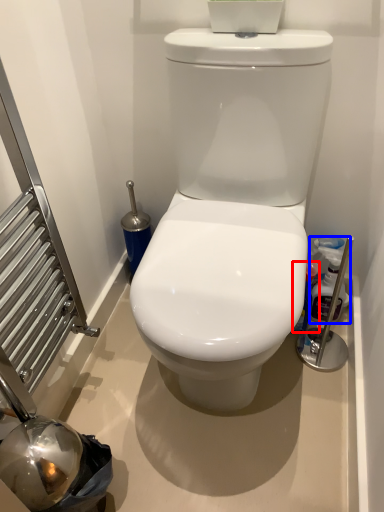
Question: Which of the following is the closest to the observer, cleaning product (highlighted by a red box) or cleaning product (highlighted by a blue box)?

Choices:
 (A) cleaning product
 (B) cleaning product

Answer: (B)